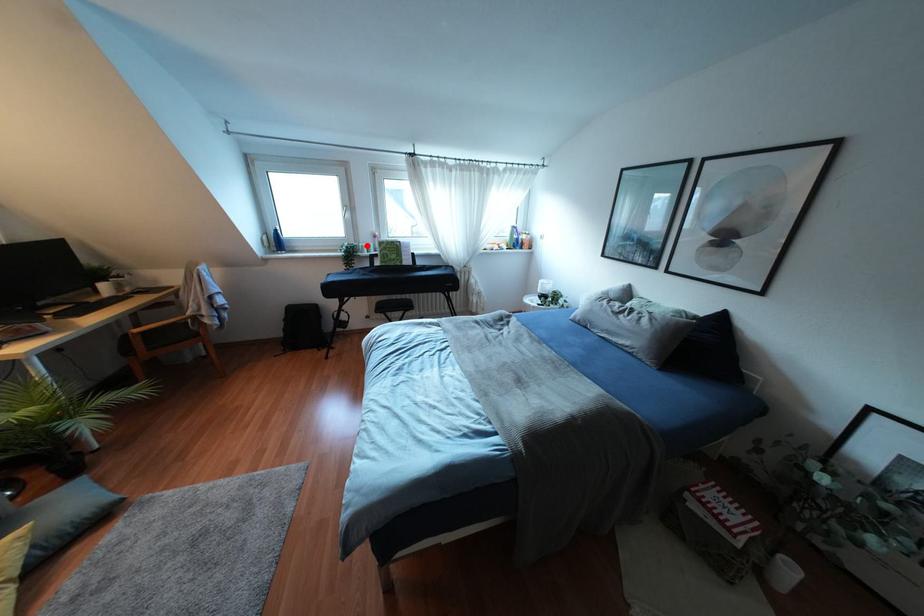
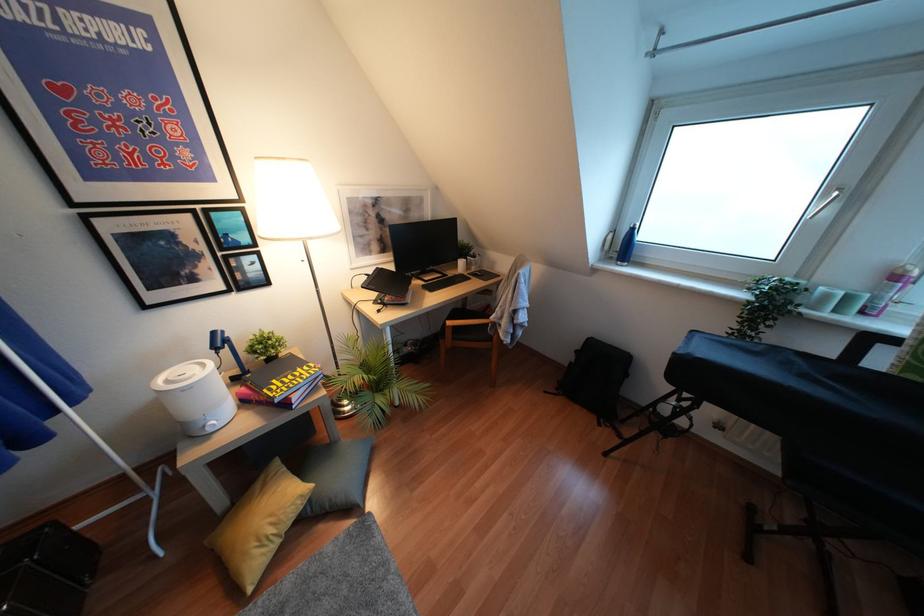
Find the pixel in the second image that matches the highlighted location in the first image.

(846, 298)